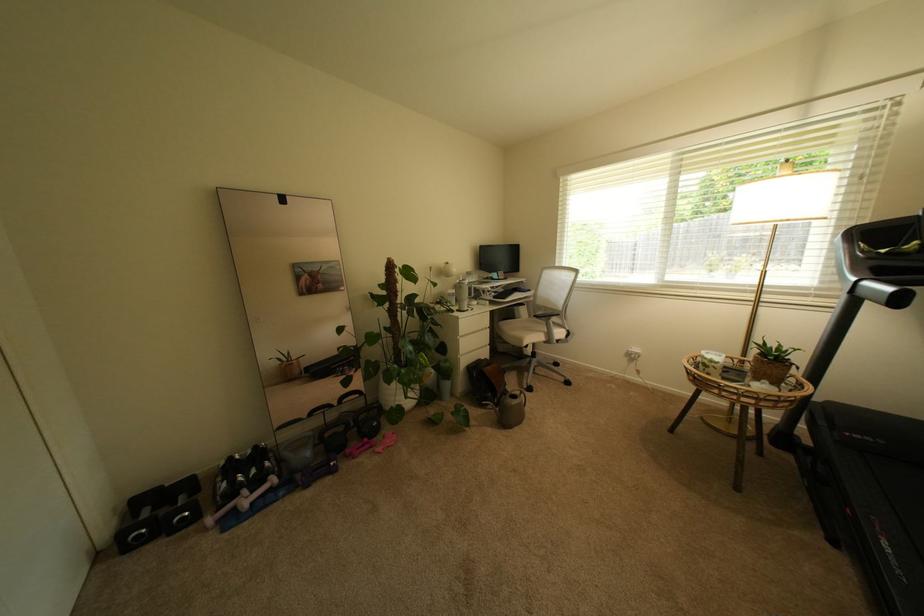
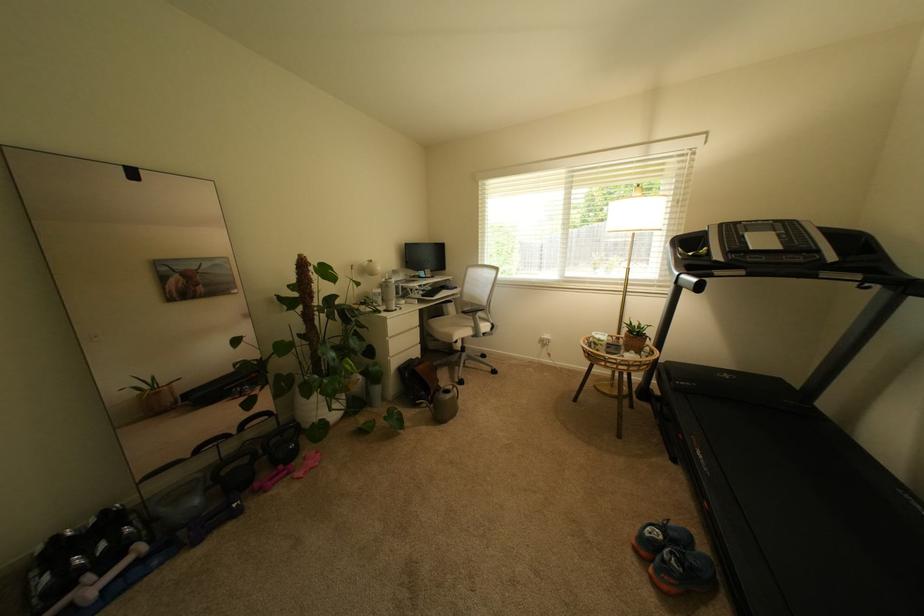
The point at (x=466, y=310) is marked in the first image. Where is the corresponding point in the second image?

(393, 310)